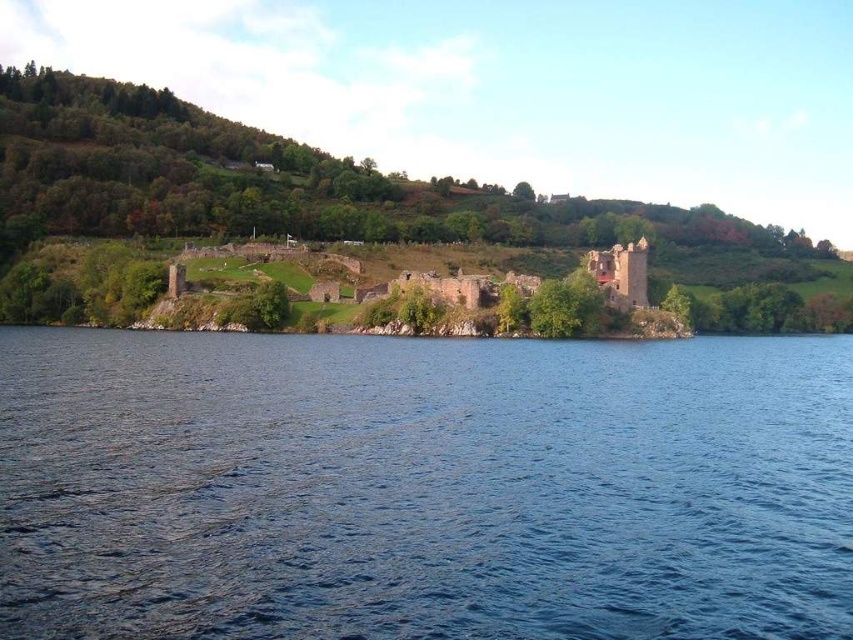
Between blue water at center and green grassy hillside at upper center, which one has less height?

With less height is blue water at center.

Between blue water at center and green grassy hillside at upper center, which one is positioned lower?

blue water at center is lower down.

Who is more distant from viewer, (547,628) or (274,209)?

The point (274,209) is behind.

What are the coordinates of `blue water at center` in the screenshot? It's located at (422, 486).

Is green grassy hillside at upper center further to camera compared to rustic stone castle at center?

Yes, green grassy hillside at upper center is further from the viewer.

Who is lower down, green grassy hillside at upper center or rustic stone castle at center?

Positioned lower is rustic stone castle at center.

I want to click on green grassy hillside at upper center, so click(309, 189).

Locate an element on the screen. green grassy hillside at upper center is located at coordinates (309, 189).

Does blue water at center have a greater width compared to rustic stone castle at center?

Correct, the width of blue water at center exceeds that of rustic stone castle at center.

Can you confirm if blue water at center is positioned below rustic stone castle at center?

Indeed, blue water at center is positioned under rustic stone castle at center.

The image size is (853, 640). In order to click on blue water at center in this screenshot , I will do `click(422, 486)`.

Find the location of a particular element. blue water at center is located at coordinates (422, 486).